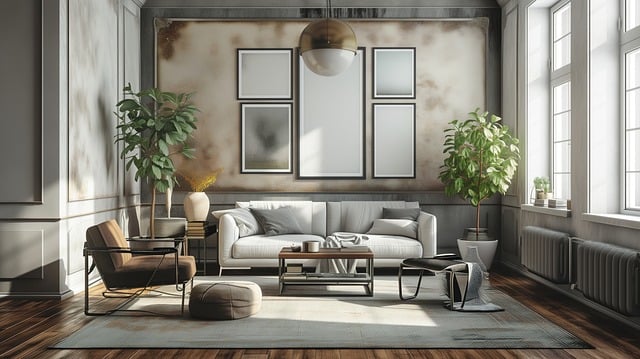
Image resolution: width=640 pixels, height=359 pixels. Find the location of `pouffe`. pouffe is located at coordinates (228, 295).